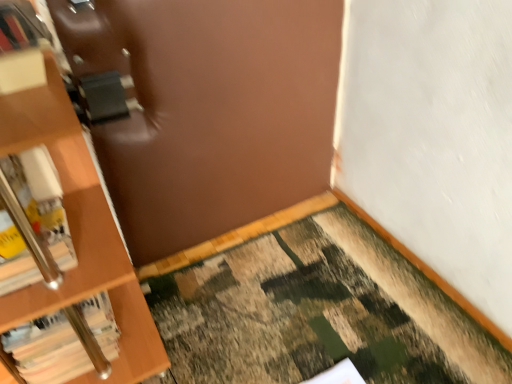
Find the location of `white matte book at left, placed as the 1th book when sorted from top to bottom`. white matte book at left, placed as the 1th book when sorted from top to bottom is located at coordinates (34, 222).

Image resolution: width=512 pixels, height=384 pixels. Describe the element at coordinates (47, 350) in the screenshot. I see `hardcover book at left, which ranks as the 1th book in bottom-to-top order` at that location.

You are a GUI agent. You are given a task and a screenshot of the screen. Output one action in this format:
    pyautogui.click(x=<x>, y=<y>)
    Task: Click on the white matte book at left, placed as the 1th book when sorted from top to bottom
    Image resolution: width=512 pixels, height=384 pixels.
    Given the screenshot: What is the action you would take?
    pyautogui.click(x=34, y=222)

Does hardcover book at left, which ranks as the 1th book in bottom-to-top order, contain camouflage carpet at lower right?

No, hardcover book at left, which ranks as the 1th book in bottom-to-top order, does not contain camouflage carpet at lower right.

Is the depth of hardcover book at left, marked as the 2th book in a top-to-bottom arrangement, greater than that of camouflage carpet at lower right?

Yes, it is.

From a real-world perspective, is hardcover book at left, marked as the 2th book in a top-to-bottom arrangement, below camouflage carpet at lower right?

No, from a real-world perspective, hardcover book at left, marked as the 2th book in a top-to-bottom arrangement, is not beneath camouflage carpet at lower right.

Is hardcover book at left, which ranks as the 1th book in bottom-to-top order, wider or thinner than camouflage carpet at lower right?

hardcover book at left, which ranks as the 1th book in bottom-to-top order, is thinner than camouflage carpet at lower right.

Does white matte book at left, placed as the 2th book when sorted from bottom to top, lie behind camouflage carpet at lower right?

Yes, it is.

From the image's perspective, which is below, white matte book at left, placed as the 2th book when sorted from bottom to top, or camouflage carpet at lower right?

camouflage carpet at lower right is shown below in the image.

Is white matte book at left, placed as the 2th book when sorted from bottom to top, smaller than camouflage carpet at lower right?

Correct, white matte book at left, placed as the 2th book when sorted from bottom to top, occupies less space than camouflage carpet at lower right.

Is white matte book at left, placed as the 1th book when sorted from top to bottom, spatially inside camouflage carpet at lower right, or outside of it?

white matte book at left, placed as the 1th book when sorted from top to bottom, is located beyond the bounds of camouflage carpet at lower right.

Does camouflage carpet at lower right appear on the left side of hardcover book at left, which ranks as the 1th book in bottom-to-top order?

In fact, camouflage carpet at lower right is to the right of hardcover book at left, which ranks as the 1th book in bottom-to-top order.

From their relative heights in the image, would you say camouflage carpet at lower right is taller or shorter than hardcover book at left, which ranks as the 1th book in bottom-to-top order?

camouflage carpet at lower right is shorter than hardcover book at left, which ranks as the 1th book in bottom-to-top order.

Considering their positions, is camouflage carpet at lower right located in front of or behind hardcover book at left, marked as the 2th book in a top-to-bottom arrangement?

camouflage carpet at lower right is in front of hardcover book at left, marked as the 2th book in a top-to-bottom arrangement.

This screenshot has height=384, width=512. In the image, there is a hardcover book at left, which ranks as the 1th book in bottom-to-top order. Identify the location of doormat below it (from the image's perspective). (318, 312).

From a real-world perspective, relative to hardcover book at left, which ranks as the 1th book in bottom-to-top order, is white matte book at left, placed as the 1th book when sorted from top to bottom, vertically above or below?

Clearly, from a real-world perspective, white matte book at left, placed as the 1th book when sorted from top to bottom, is above hardcover book at left, which ranks as the 1th book in bottom-to-top order.

Can you see white matte book at left, placed as the 1th book when sorted from top to bottom, touching hardcover book at left, which ranks as the 1th book in bottom-to-top order?

white matte book at left, placed as the 1th book when sorted from top to bottom, and hardcover book at left, which ranks as the 1th book in bottom-to-top order, are clearly separated.

Considering the positions of points (4, 276) and (84, 361), is point (4, 276) farther from camera compared to point (84, 361)?

No, (4, 276) is in front of (84, 361).

This screenshot has width=512, height=384. In order to click on the 2nd book counting from the left of the camouflage carpet at lower right in this screenshot , I will do `click(34, 222)`.

Which object is positioned more to the left, camouflage carpet at lower right or white matte book at left, placed as the 2th book when sorted from bottom to top?

white matte book at left, placed as the 2th book when sorted from bottom to top.

Is white matte book at left, placed as the 2th book when sorted from bottom to top, a part of camouflage carpet at lower right?

That's incorrect, white matte book at left, placed as the 2th book when sorted from bottom to top, is not inside camouflage carpet at lower right.

How many degrees apart are the facing directions of hardcover book at left, which ranks as the 1th book in bottom-to-top order, and white matte book at left, placed as the 1th book when sorted from top to bottom?

1.73 degrees.

Which is correct: hardcover book at left, which ranks as the 1th book in bottom-to-top order, is inside white matte book at left, placed as the 2th book when sorted from bottom to top, or outside of it?

hardcover book at left, which ranks as the 1th book in bottom-to-top order, is not enclosed by white matte book at left, placed as the 2th book when sorted from bottom to top.

From the picture: Is hardcover book at left, which ranks as the 1th book in bottom-to-top order, positioned before white matte book at left, placed as the 2th book when sorted from bottom to top?

No, it is not.

From a real-world perspective, between hardcover book at left, which ranks as the 1th book in bottom-to-top order, and white matte book at left, placed as the 2th book when sorted from bottom to top, who is vertically lower?

hardcover book at left, which ranks as the 1th book in bottom-to-top order, is physically lower.

In order to click on doormat located in front of the hardcover book at left, marked as the 2th book in a top-to-bottom arrangement in this screenshot , I will do `click(318, 312)`.

From the camouflage carpet at lower right, count 1st books backward and point to it. Please provide its 2D coordinates.

[(34, 222)]

Estimate the real-world distances between objects in this image. Which object is further from white matte book at left, placed as the 2th book when sorted from bottom to top, hardcover book at left, marked as the 2th book in a top-to-bottom arrangement, or camouflage carpet at lower right?

camouflage carpet at lower right lies further to white matte book at left, placed as the 2th book when sorted from bottom to top, than the other object.

Which object lies nearer to the anchor point hardcover book at left, marked as the 2th book in a top-to-bottom arrangement, camouflage carpet at lower right or white matte book at left, placed as the 1th book when sorted from top to bottom?

white matte book at left, placed as the 1th book when sorted from top to bottom, is closer to hardcover book at left, marked as the 2th book in a top-to-bottom arrangement.

Which object lies nearer to the anchor point camouflage carpet at lower right, hardcover book at left, which ranks as the 1th book in bottom-to-top order, or white matte book at left, placed as the 1th book when sorted from top to bottom?

hardcover book at left, which ranks as the 1th book in bottom-to-top order, is closer to camouflage carpet at lower right.

From the image, which object appears to be nearer to camouflage carpet at lower right, white matte book at left, placed as the 1th book when sorted from top to bottom, or hardcover book at left, marked as the 2th book in a top-to-bottom arrangement?

Based on the image, hardcover book at left, marked as the 2th book in a top-to-bottom arrangement, appears to be nearer to camouflage carpet at lower right.

From the image, which object appears to be farther from white matte book at left, placed as the 2th book when sorted from bottom to top, camouflage carpet at lower right or hardcover book at left, which ranks as the 1th book in bottom-to-top order?

The object further to white matte book at left, placed as the 2th book when sorted from bottom to top, is camouflage carpet at lower right.

Considering their positions, is white matte book at left, placed as the 1th book when sorted from top to bottom, positioned further to hardcover book at left, which ranks as the 1th book in bottom-to-top order, than camouflage carpet at lower right?

camouflage carpet at lower right lies further to hardcover book at left, which ranks as the 1th book in bottom-to-top order, than the other object.

The width and height of the screenshot is (512, 384). I want to click on book between white matte book at left, placed as the 1th book when sorted from top to bottom, and camouflage carpet at lower right, in the horizontal direction, so click(47, 350).